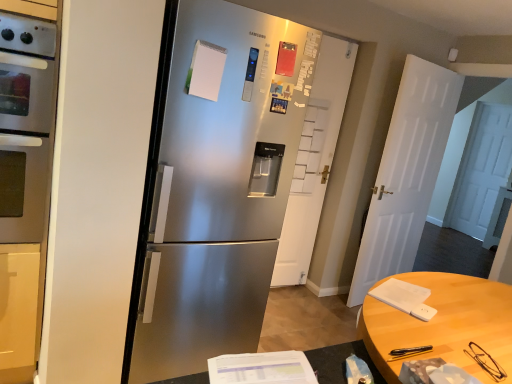
Question: Considering the relative sizes of satin silver refrigerator at center and white matte door at center, which is counted as the first door, starting from the right, in the image provided, is satin silver refrigerator at center wider than white matte door at center, which is counted as the first door, starting from the right,?

Choices:
 (A) yes
 (B) no

Answer: (A)

Question: From the image's perspective, is satin silver refrigerator at center under white matte door at center, which is counted as the first door, starting from the right?

Choices:
 (A) no
 (B) yes

Answer: (B)

Question: Considering the relative sizes of satin silver refrigerator at center and white matte door at center, arranged as the second door when viewed from the left, in the image provided, is satin silver refrigerator at center bigger than white matte door at center, arranged as the second door when viewed from the left,?

Choices:
 (A) no
 (B) yes

Answer: (B)

Question: Does satin silver refrigerator at center turn towards white matte door at center, which is counted as the first door, starting from the right?

Choices:
 (A) yes
 (B) no

Answer: (B)

Question: Can you confirm if satin silver refrigerator at center is taller than white matte door at center, which is counted as the first door, starting from the right?

Choices:
 (A) yes
 (B) no

Answer: (B)

Question: Would you say satin silver refrigerator at center is to the left or to the right of satin silver oven at left in the picture?

Choices:
 (A) left
 (B) right

Answer: (B)

Question: Is satin silver refrigerator at center bigger or smaller than satin silver oven at left?

Choices:
 (A) big
 (B) small

Answer: (A)

Question: Is satin silver refrigerator at center inside the boundaries of satin silver oven at left, or outside?

Choices:
 (A) outside
 (B) inside

Answer: (A)

Question: Does point (155, 342) appear closer or farther from the camera than point (50, 46)?

Choices:
 (A) farther
 (B) closer

Answer: (A)

Question: From a real-world perspective, relative to light brown wooden table at lower right, is white matte door at center, arranged as the second door when viewed from the left, vertically above or below?

Choices:
 (A) above
 (B) below

Answer: (A)

Question: Looking at the image, does white matte door at center, arranged as the second door when viewed from the left, seem bigger or smaller compared to light brown wooden table at lower right?

Choices:
 (A) small
 (B) big

Answer: (A)

Question: In the image, is white matte door at center, arranged as the second door when viewed from the left, on the left side or the right side of light brown wooden table at lower right?

Choices:
 (A) right
 (B) left

Answer: (A)

Question: From the image's perspective, relative to light brown wooden table at lower right, is white matte door at center, which is counted as the first door, starting from the right, above or below?

Choices:
 (A) below
 (B) above

Answer: (B)

Question: Is light brown wooden table at lower right wider or thinner than white matte door at center, which is counted as the first door, starting from the right?

Choices:
 (A) thin
 (B) wide

Answer: (B)

Question: Considering the positions of light brown wooden table at lower right and white matte door at center, which is counted as the first door, starting from the right, in the image, is light brown wooden table at lower right bigger or smaller than white matte door at center, which is counted as the first door, starting from the right,?

Choices:
 (A) big
 (B) small

Answer: (A)